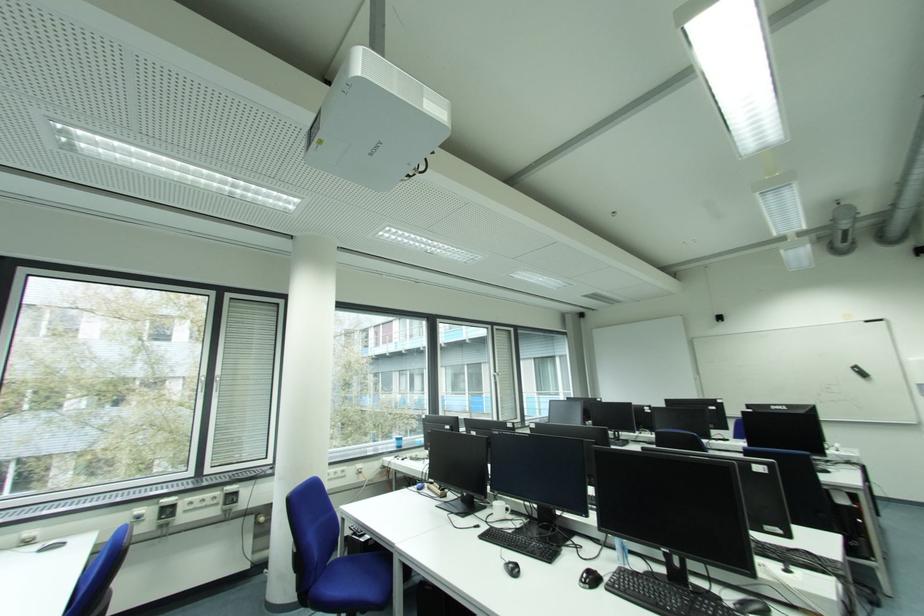
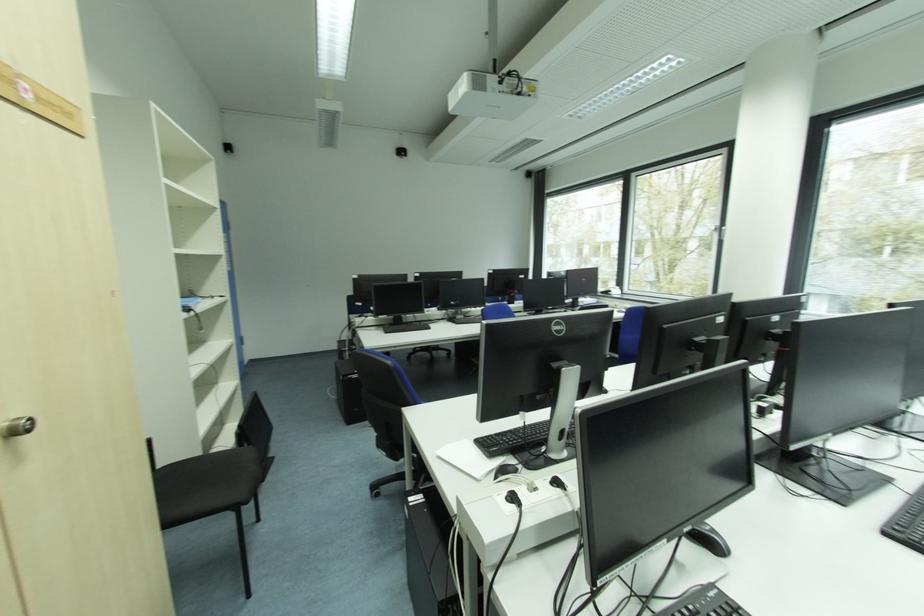
Question: I am providing you with two images of the same scene from different viewpoints. Please identify which objects are invisible in image2.

Choices:
 (A) black power plug
 (B) black mouse
 (C) blue chair sitting surface
 (D) glass jar

Answer: (C)